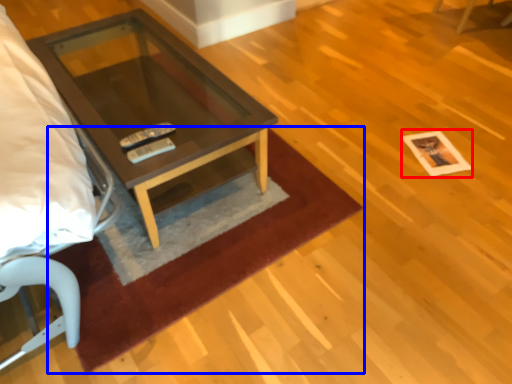
Question: Which of the following is the farthest to the observer, square (highlighted by a red box) or mat (highlighted by a blue box)?

Choices:
 (A) square
 (B) mat

Answer: (A)